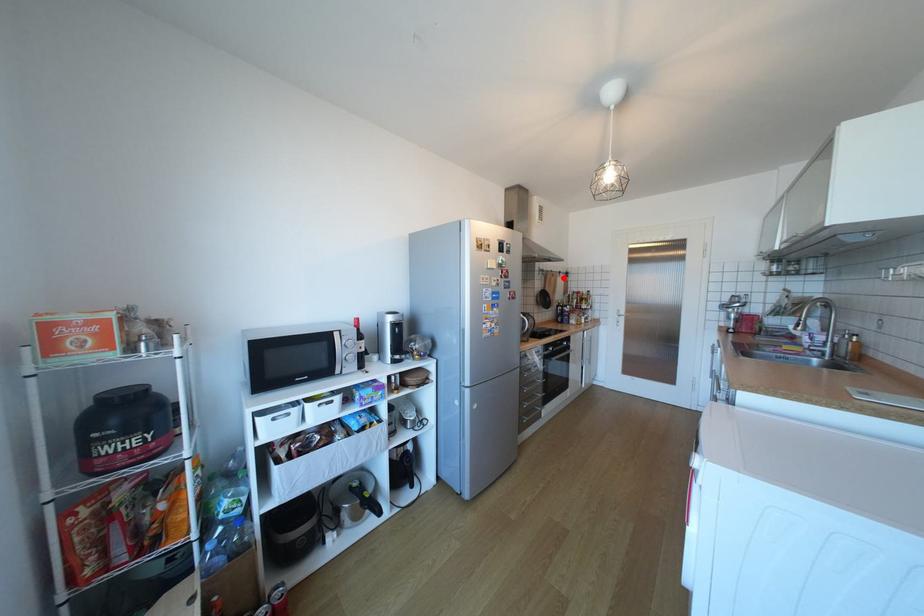
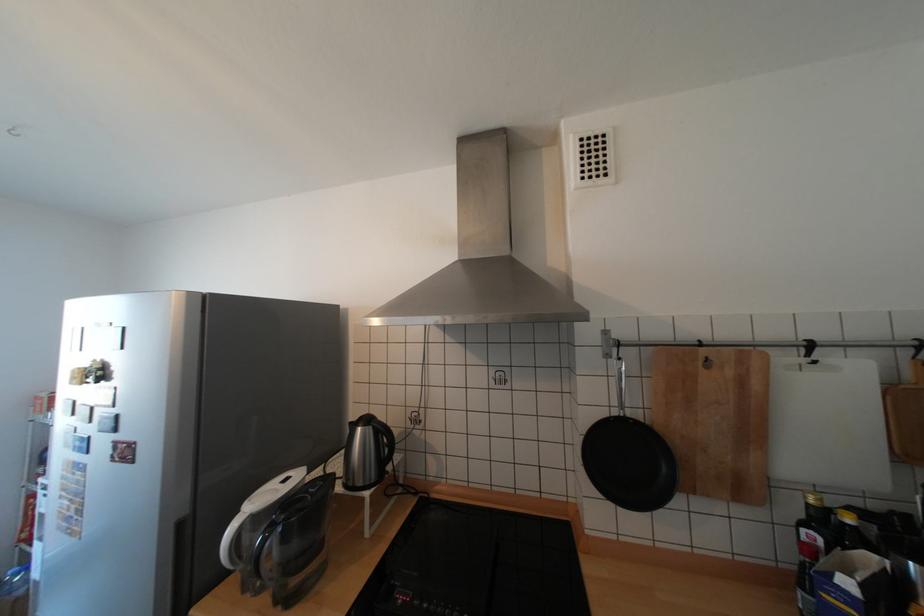
Locate, in the second image, the point that corresponds to the highlighted location in the first image.

(738, 371)